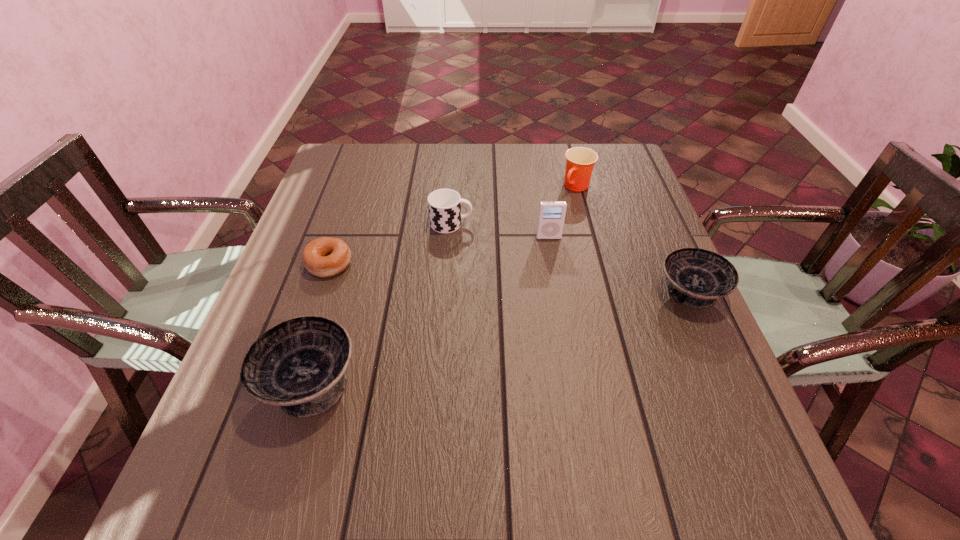
Identify the location of free location at the far right corner. The image size is (960, 540). (597, 167).

The width and height of the screenshot is (960, 540). Identify the location of vacant area at the near right corner of the desktop. (682, 410).

Find the location of a particular element. This screenshot has width=960, height=540. free space between the right bowl and the fourth nearest object is located at coordinates (619, 265).

Identify the location of unoccupied area between the shortest object and the shorter bowl. The height and width of the screenshot is (540, 960). (510, 278).

Identify the location of vacant space that is in between the fourth nearest object and the shorter cup. (500, 231).

Identify the location of unoccupied position between the farther cup and the nearer bowl. (444, 285).

Locate an element on the screen. The image size is (960, 540). vacant point located between the left cup and the taller bowl is located at coordinates pos(381,303).

Locate an element on the screen. This screenshot has height=540, width=960. unoccupied position between the second farthest object and the iPod is located at coordinates (500, 231).

Where is `free space between the taller bowl and the left cup`? Image resolution: width=960 pixels, height=540 pixels. free space between the taller bowl and the left cup is located at coordinates (381, 303).

Identify which object is the fourth closest to the shorter cup. Please provide its 2D coordinates. Your answer should be formatted as a tuple, i.e. [(x, y)], where the tuple contains the x and y coordinates of a point satisfying the conditions above.

[(299, 364)]